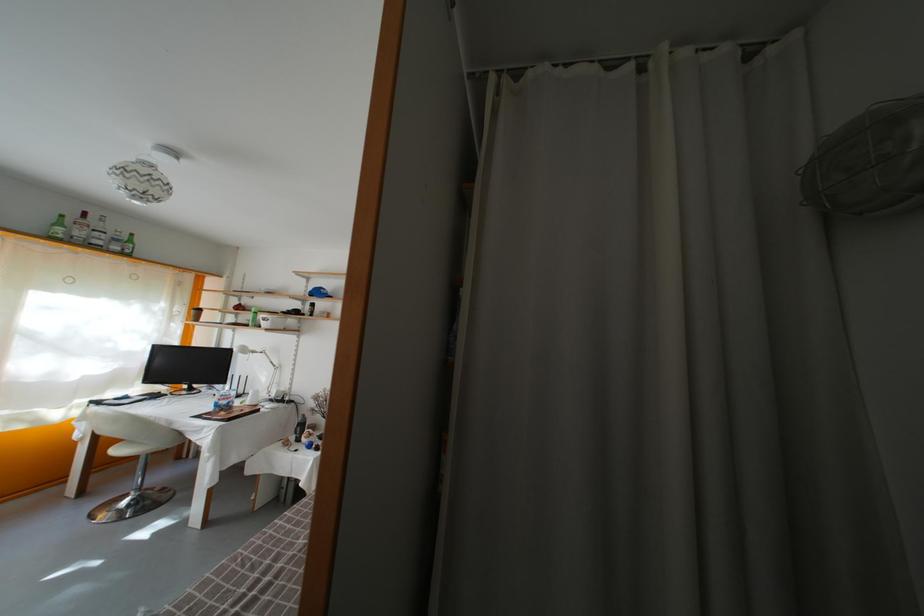
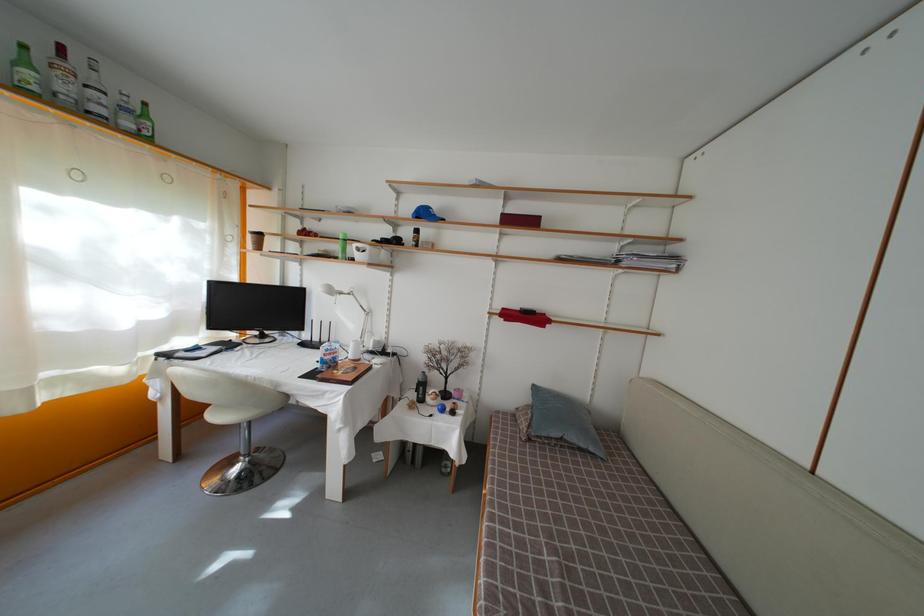
Find the pixel in the second image that matches (123,456) in the first image.

(221, 422)